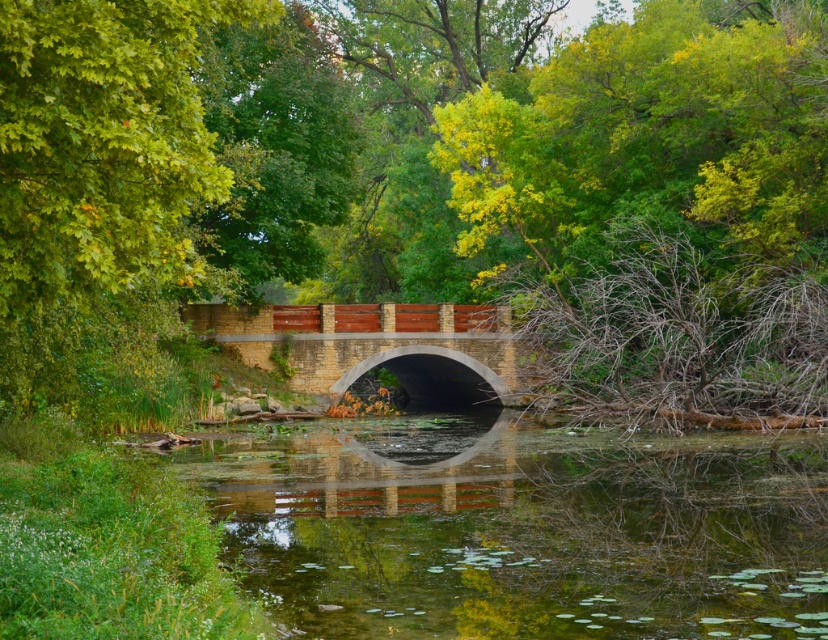
You are a landscape architect designing a walking path that needs to pass between the green reflective water at center and the green leafy tree at left. The path must be at least 15 feet wide to accommodate visitors. Can the existing space between them accommodate this requirement?

The distance between the green reflective water at center and the green leafy tree at left is 15.71 feet, which is just over the required 15 feet. Therefore, the existing space can accommodate the path.